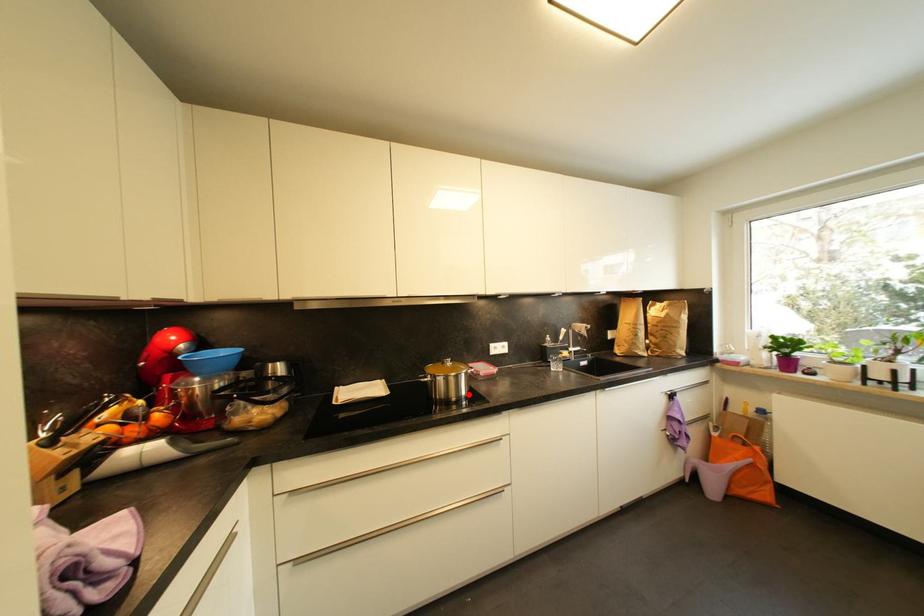
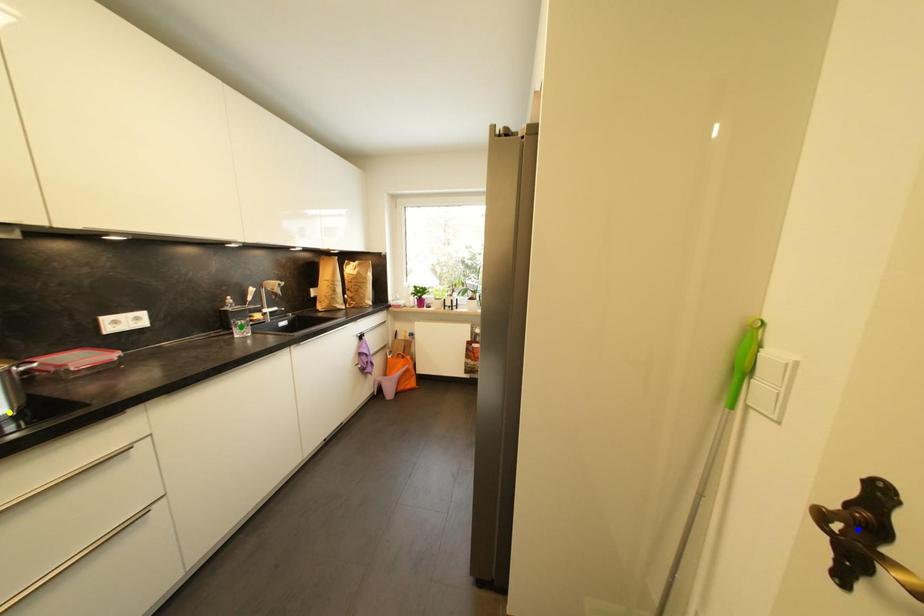
Question: I am providing you with two images of the same scene from different viewpoints. A red point is marked on the first image. You are given multiple points on the second image. Which mark in image 2 goes with the point in image 1?

Choices:
 (A) blue point
 (B) yellow point
 (C) green point

Answer: (B)